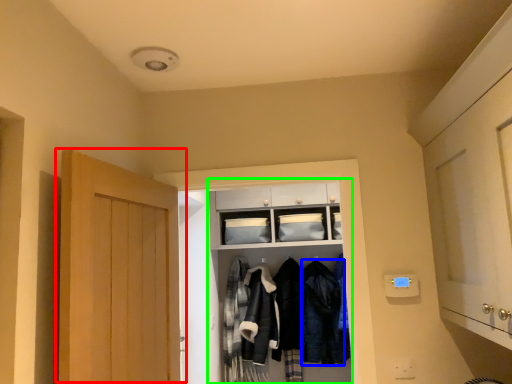
Question: Based on their relative distances, which object is farther from door (highlighted by a red box)? Choose from clothing (highlighted by a blue box) and closet (highlighted by a green box).

Choices:
 (A) clothing
 (B) closet

Answer: (A)